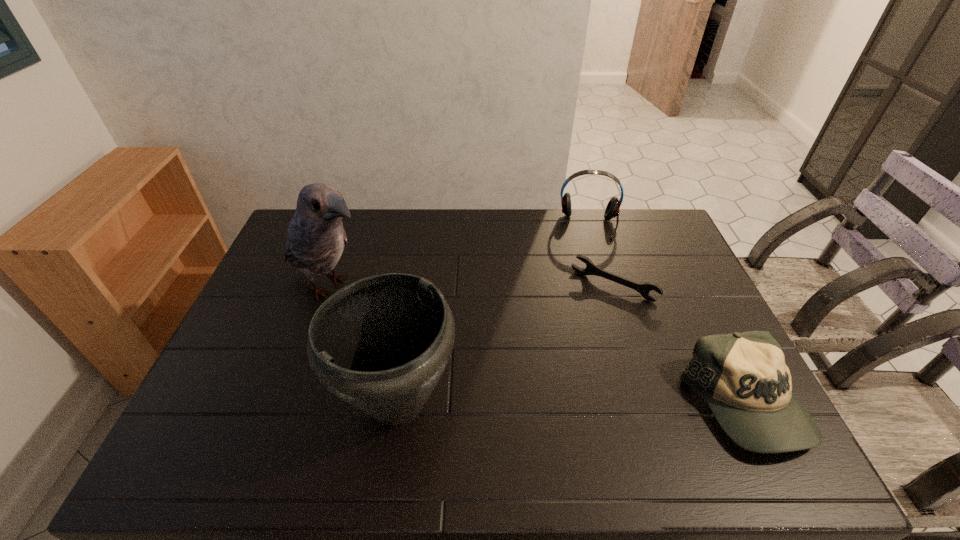
The image size is (960, 540). I want to click on urn, so [381, 344].

Identify the location of the fourth tallest object. The height and width of the screenshot is (540, 960). (x=743, y=377).

This screenshot has width=960, height=540. Find the location of `the tallest object`. the tallest object is located at coordinates (316, 237).

Identify the location of the farthest object. (612, 210).

You are a GUI agent. You are given a task and a screenshot of the screen. Output one action in this format:
    pyautogui.click(x=<x>, y=<y>)
    Task: Click on the headset
    
    Given the screenshot: What is the action you would take?
    click(x=612, y=210)

Find the location of a particular element. The height and width of the screenshot is (540, 960). the shortest object is located at coordinates (591, 269).

Image resolution: width=960 pixels, height=540 pixels. I want to click on blank space located on the right of the urn, so click(499, 404).

You are a GUI agent. You are given a task and a screenshot of the screen. Output one action in this format:
    pyautogui.click(x=<x>, y=<y>)
    Task: Click on the vacant space situated 0.370m on the front-facing side of the tallest object
    
    Given the screenshot: What is the action you would take?
    pyautogui.click(x=468, y=349)

Identify the location of vacant space located on the front-facing side of the tallest object. (454, 341).

You are a GUI agent. You are given a task and a screenshot of the screen. Output one action in this format:
    pyautogui.click(x=<x>, y=<y>)
    Task: Click on the vacant region located 0.310m on the front-facing side of the tallest object
    The image size is (960, 540).
    Given the screenshot: What is the action you would take?
    pyautogui.click(x=450, y=340)